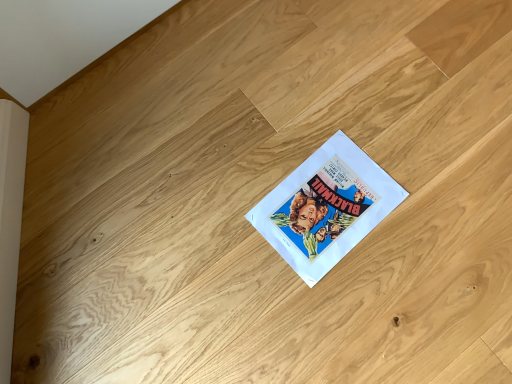
Where is `vacant region in front of white paper at center`? vacant region in front of white paper at center is located at coordinates (350, 316).